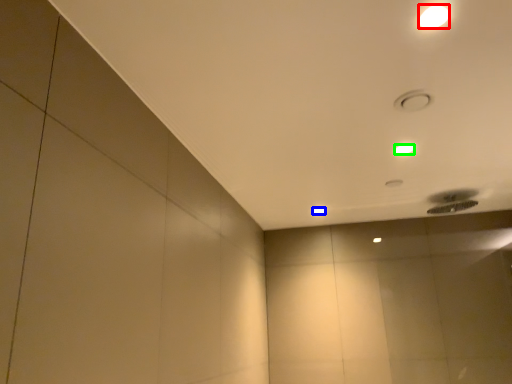
Question: Based on their relative distances, which object is farther from lamp (highlighted by a red box)? Choose from lamp (highlighted by a blue box) and lamp (highlighted by a green box).

Choices:
 (A) lamp
 (B) lamp

Answer: (A)